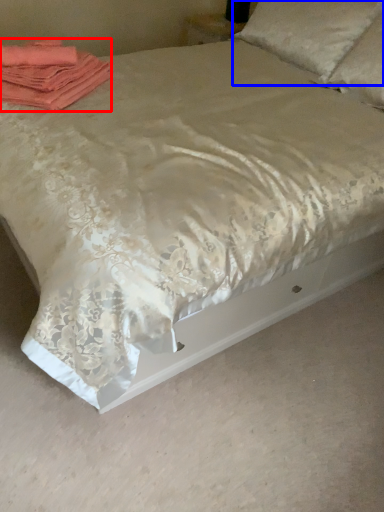
Question: Which object is closer to the camera taking this photo, material (highlighted by a red box) or pillow (highlighted by a blue box)?

Choices:
 (A) material
 (B) pillow

Answer: (A)